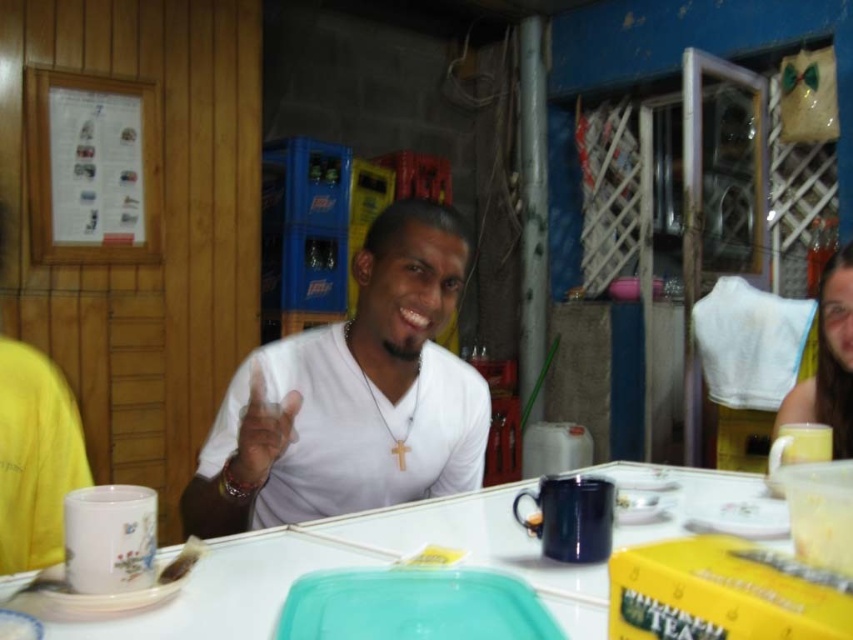
Which is more to the left, white glossy table at center or matte yellow mug at right?

white glossy table at center

This screenshot has width=853, height=640. What do you see at coordinates (357, 564) in the screenshot?
I see `white glossy table at center` at bounding box center [357, 564].

Between point (634, 465) and point (840, 268), which one is positioned in front?

Point (840, 268) is more forward.

This screenshot has height=640, width=853. I want to click on white glossy table at center, so click(x=357, y=564).

Looking at this image, does matte yellow mug at right appear on the right side of brown crumbly bread at lower center?

Yes, matte yellow mug at right is to the right of brown crumbly bread at lower center.

Is point (779, 426) behind point (184, 554)?

Yes, point (779, 426) is behind point (184, 554).

You are a GUI agent. You are given a task and a screenshot of the screen. Output one action in this format:
    pyautogui.click(x=<x>, y=<y>)
    Task: Click on the matte yellow mug at right
    
    Given the screenshot: What is the action you would take?
    pyautogui.click(x=828, y=360)

Between white matte shirt at center and brown crumbly bread at lower center, which one appears on the right side from the viewer's perspective?

Positioned to the right is white matte shirt at center.

Measure the distance between white matte shirt at center and brown crumbly bread at lower center.

white matte shirt at center and brown crumbly bread at lower center are 15.33 inches apart from each other.

Is point (334, 452) closer to camera compared to point (190, 538)?

No, it is behind (190, 538).

In order to click on white matte shirt at center in this screenshot , I will do `click(352, 396)`.